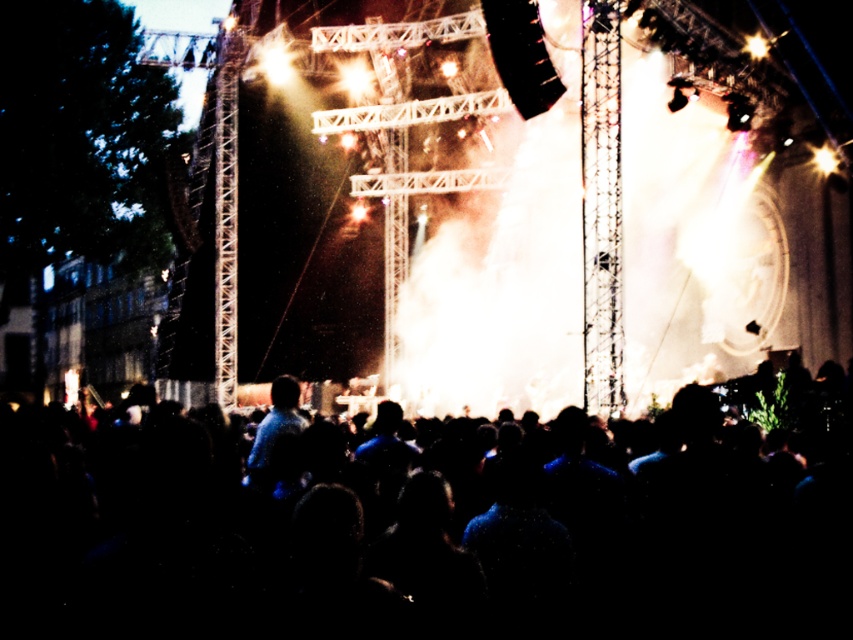
Question: Can you confirm if black matte crowd at center is thinner than blue fabric shirt at center?

Choices:
 (A) yes
 (B) no

Answer: (B)

Question: Does black matte crowd at center have a lesser width compared to blue fabric shirt at center?

Choices:
 (A) no
 (B) yes

Answer: (A)

Question: Does black matte crowd at center lie behind blue fabric shirt at center?

Choices:
 (A) yes
 (B) no

Answer: (B)

Question: Which of the following is the farthest from the observer?

Choices:
 (A) black matte crowd at center
 (B) blue fabric shirt at center

Answer: (B)